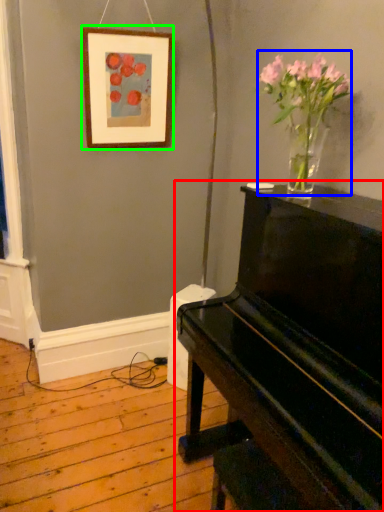
Question: Estimate the real-world distances between objects in this image. Which object is closer to piano (highlighted by a red box), floral arrangement (highlighted by a blue box) or picture frame (highlighted by a green box)?

Choices:
 (A) floral arrangement
 (B) picture frame

Answer: (A)